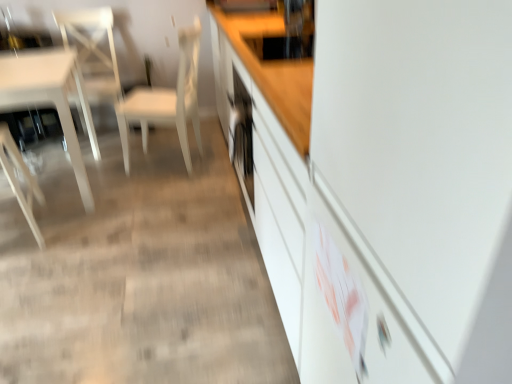
Question: Considering the relative sizes of wooden chair at left, the 1th chair in the left-to-right sequence, and white matte chair at center, positioned as the 3th chair in left-to-right order, in the image provided, is wooden chair at left, the 1th chair in the left-to-right sequence, bigger than white matte chair at center, positioned as the 3th chair in left-to-right order,?

Choices:
 (A) no
 (B) yes

Answer: (A)

Question: Would you say wooden chair at left, the 1th chair in the left-to-right sequence, is outside white matte chair at center, acting as the 1th chair starting from the right?

Choices:
 (A) yes
 (B) no

Answer: (A)

Question: Would you consider wooden chair at left, the 1th chair in the left-to-right sequence, to be distant from white matte chair at center, acting as the 1th chair starting from the right?

Choices:
 (A) yes
 (B) no

Answer: (B)

Question: Does wooden chair at left, which appears as the third chair when viewed from the right, have a smaller size compared to white matte chair at center, acting as the 1th chair starting from the right?

Choices:
 (A) yes
 (B) no

Answer: (A)

Question: From a real-world perspective, is wooden chair at left, which appears as the third chair when viewed from the right, below white matte chair at center, positioned as the 3th chair in left-to-right order?

Choices:
 (A) yes
 (B) no

Answer: (A)

Question: Does wooden chair at left, the 1th chair in the left-to-right sequence, come behind white matte chair at center, positioned as the 3th chair in left-to-right order?

Choices:
 (A) yes
 (B) no

Answer: (B)

Question: From a real-world perspective, does white matte chair at center, positioned as the 3th chair in left-to-right order, sit lower than white glossy chair at left, the 2th chair when ordered from right to left?

Choices:
 (A) yes
 (B) no

Answer: (B)

Question: Does white matte chair at center, positioned as the 3th chair in left-to-right order, lie in front of white glossy chair at left, the 2th chair when ordered from left to right?

Choices:
 (A) no
 (B) yes

Answer: (B)

Question: From a real-world perspective, does white matte chair at center, positioned as the 3th chair in left-to-right order, stand above white glossy chair at left, the 2th chair when ordered from right to left?

Choices:
 (A) no
 (B) yes

Answer: (B)

Question: Is white matte chair at center, acting as the 1th chair starting from the right, thinner than white glossy chair at left, the 2th chair when ordered from left to right?

Choices:
 (A) yes
 (B) no

Answer: (B)

Question: Considering the relative sizes of white matte chair at center, positioned as the 3th chair in left-to-right order, and white glossy chair at left, the 2th chair when ordered from left to right, in the image provided, is white matte chair at center, positioned as the 3th chair in left-to-right order, bigger than white glossy chair at left, the 2th chair when ordered from left to right,?

Choices:
 (A) no
 (B) yes

Answer: (B)

Question: Can we say white matte chair at center, acting as the 1th chair starting from the right, lies outside white glossy chair at left, the 2th chair when ordered from left to right?

Choices:
 (A) no
 (B) yes

Answer: (B)

Question: From the image's perspective, is white glossy chair at left, the 2th chair when ordered from right to left, over white matte chair at center, acting as the 1th chair starting from the right?

Choices:
 (A) yes
 (B) no

Answer: (A)